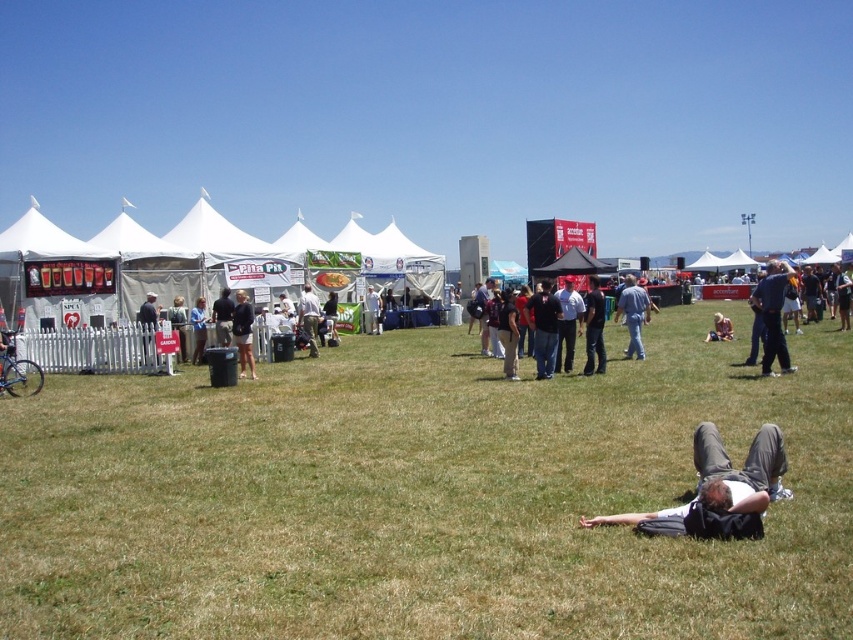
Is point (549, 355) positioned in front of point (585, 342)?

Yes, it is in front of point (585, 342).

Is dark red shirt at center smaller than dark blue jeans at center?

No, dark red shirt at center is not smaller than dark blue jeans at center.

You are a GUI agent. You are given a task and a screenshot of the screen. Output one action in this format:
    pyautogui.click(x=<x>, y=<y>)
    Task: Click on the dark red shirt at center
    The image size is (853, 640).
    Given the screenshot: What is the action you would take?
    pyautogui.click(x=561, y=324)

Locate an element on the screen. The height and width of the screenshot is (640, 853). dark red shirt at center is located at coordinates (561, 324).

Where is `jeans at center`? This screenshot has width=853, height=640. jeans at center is located at coordinates (633, 314).

Where is `jeans at center`? The image size is (853, 640). jeans at center is located at coordinates (633, 314).

Can you confirm if white fabric tent at center is positioned to the left of dark gray shorts at center?

Correct, you'll find white fabric tent at center to the left of dark gray shorts at center.

Identify the location of white fabric tent at center. The height and width of the screenshot is (640, 853). (132, 262).